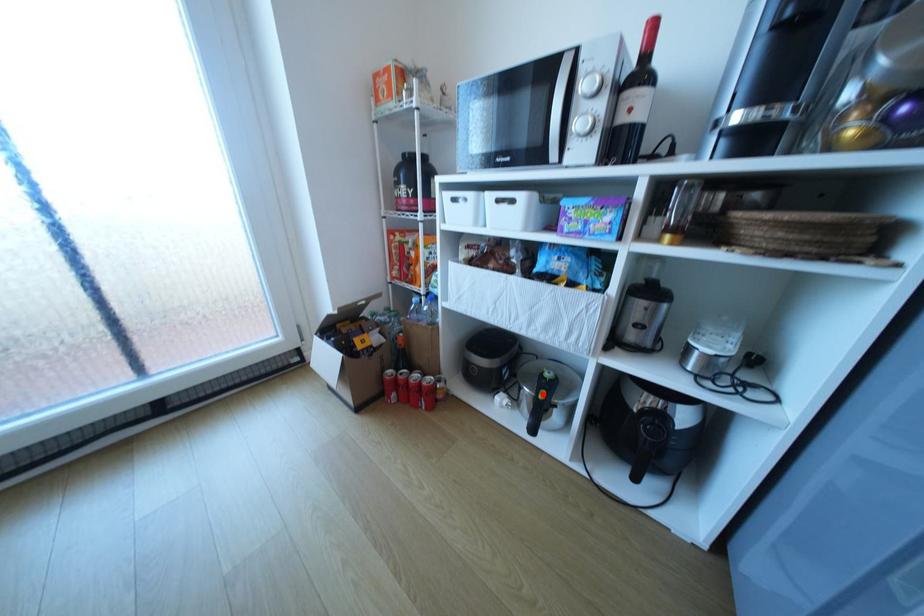
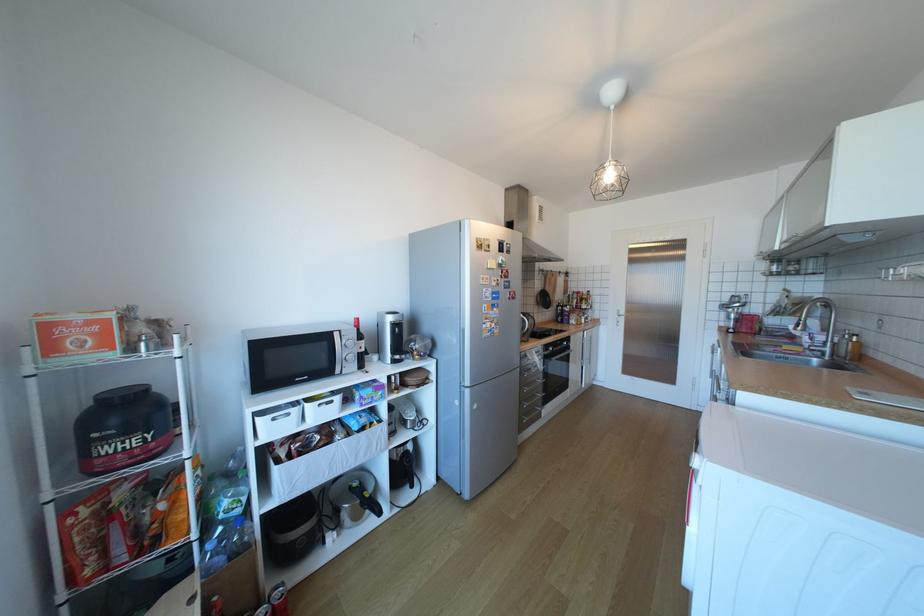
Question: I am providing you with two images of the same scene from different viewpoints. A red point is shown in image1. For the corresponding object point in image2, is it positioned nearer or farther from the camera?

Choices:
 (A) Nearer
 (B) Farther

Answer: (B)